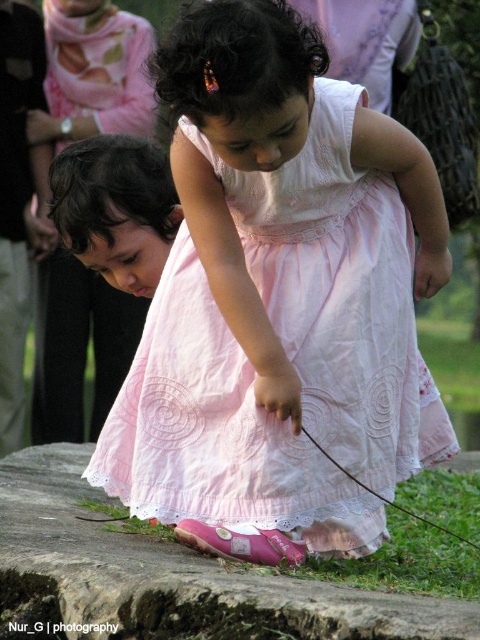
Looking at this image, is pink fabric shoe at lower center smaller than pink fabric dress at lower center?

No, pink fabric shoe at lower center is not smaller than pink fabric dress at lower center.

Is pink fabric shoe at lower center to the left of pink fabric dress at lower center from the viewer's perspective?

Indeed, pink fabric shoe at lower center is positioned on the left side of pink fabric dress at lower center.

Locate an element on the screen. The image size is (480, 640). pink fabric shoe at lower center is located at coordinates (180, 573).

Locate an element on the screen. Image resolution: width=480 pixels, height=640 pixels. pink fabric shoe at lower center is located at coordinates pos(180,573).

Between pink cotton dress at center and pink fabric shoe at lower center, which one is positioned lower?

pink fabric shoe at lower center is below.

Describe the element at coordinates (340, 294) in the screenshot. I see `pink cotton dress at center` at that location.

Find the location of a particular element. This screenshot has width=480, height=640. pink cotton dress at center is located at coordinates click(x=340, y=294).

Who is positioned more to the left, pink cotton dress at center or pink fabric dress at lower center?

pink cotton dress at center is more to the left.

Is pink cotton dress at center wider than pink fabric dress at lower center?

Yes.

Locate an element on the screen. The image size is (480, 640). pink cotton dress at center is located at coordinates (340, 294).

Identify the location of pink cotton dress at center. (340, 294).